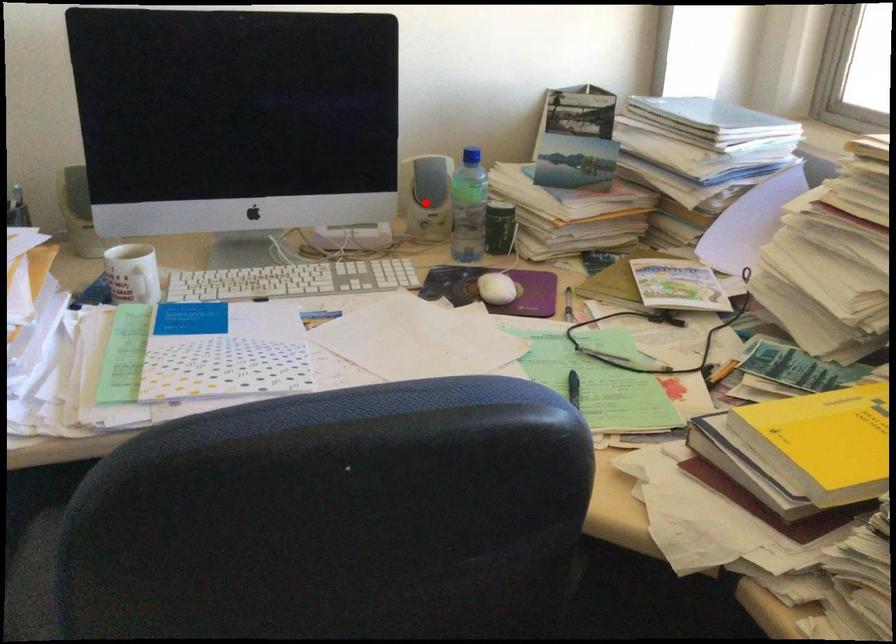
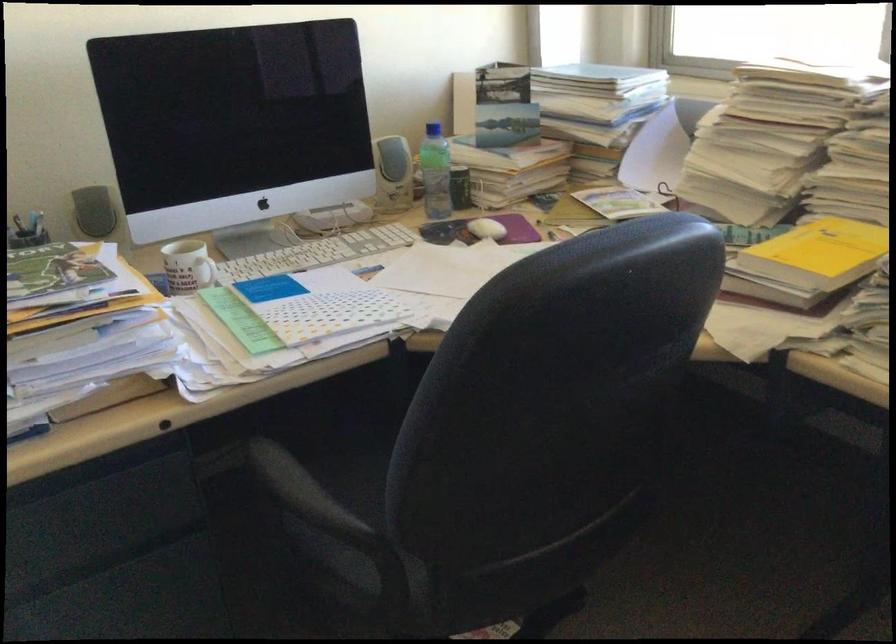
Question: I am providing you with two images of the same scene from different viewpoints. Image1 has a red point marked. In image2, the corresponding 3D location appears at what relative position? Reply with the corresponding letter.

Choices:
 (A) Closer
 (B) Farther

Answer: (B)